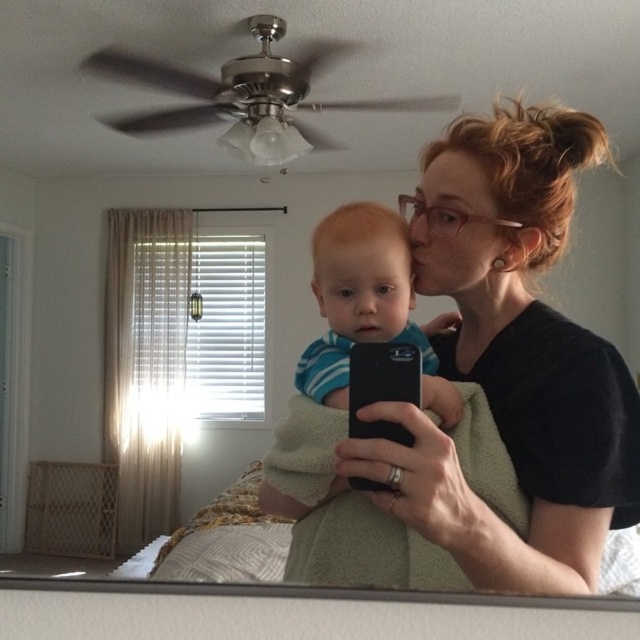
Is black matte shirt at center thinner than smooth blue striped shirt at center?

In fact, black matte shirt at center might be wider than smooth blue striped shirt at center.

Who is more forward, (576, 392) or (396, 282)?

Point (576, 392) is more forward.

You are a GUI agent. You are given a task and a screenshot of the screen. Output one action in this format:
    pyautogui.click(x=<x>, y=<y>)
    Task: Click on the black matte shirt at center
    The image size is (640, 640).
    Given the screenshot: What is the action you would take?
    pyautogui.click(x=513, y=358)

Between smooth blue striped shirt at center and black matte smartphone at center, which one has less height?

With less height is black matte smartphone at center.

Is smooth blue striped shirt at center below black matte smartphone at center?

No, smooth blue striped shirt at center is not below black matte smartphone at center.

At what (x,y) coordinates should I click in order to perform the action: click on smooth blue striped shirt at center. Please return your answer as a coordinate pair (x, y). This screenshot has height=640, width=640. Looking at the image, I should click on (362, 301).

Can you confirm if black matte shirt at center is wider than black matte smartphone at center?

Yes, black matte shirt at center is wider than black matte smartphone at center.

Who is more distant from viewer, (x=509, y=244) or (x=406, y=348)?

Point (x=509, y=244)

Where is `black matte shirt at center`? This screenshot has width=640, height=640. black matte shirt at center is located at coordinates (513, 358).